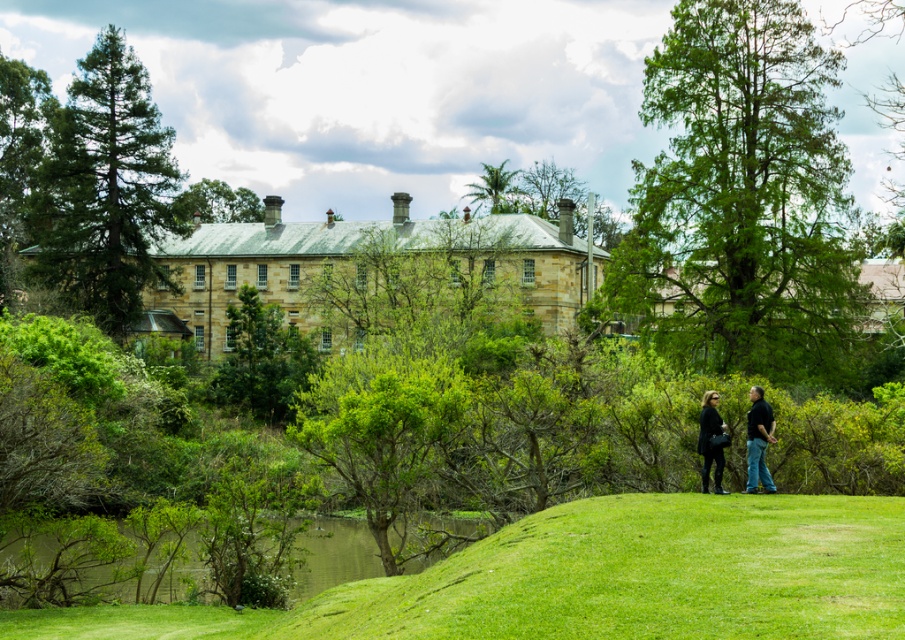
Consider the image. You are standing in the outdoor scene and want to walk towards the green leafy tree at upper left and the green leafy tree at upper center. Which tree will you reach first?

The green leafy tree at upper left is closer to the viewer than the green leafy tree at upper center, so you will reach the green leafy tree at upper left first.

You are planning to install a bench between the green leafy tree at upper right and the green leafy tree at left. If the bench requires a minimum of 50 meters of space between the two trees to be placed comfortably, can you install it here?

The distance between the green leafy tree at upper right and the green leafy tree at left is 64.01 meters, which is more than the required 50 meters. Therefore, the bench can be comfortably installed between them.

Based on the photo, you are standing at the base of the green leafy tree at upper right and want to walk directly towards the camera. How far will you have to walk to reach the camera?

The green leafy tree at upper right is 245.41 feet away from camera, so you will have to walk 245.41 feet to reach the camera.